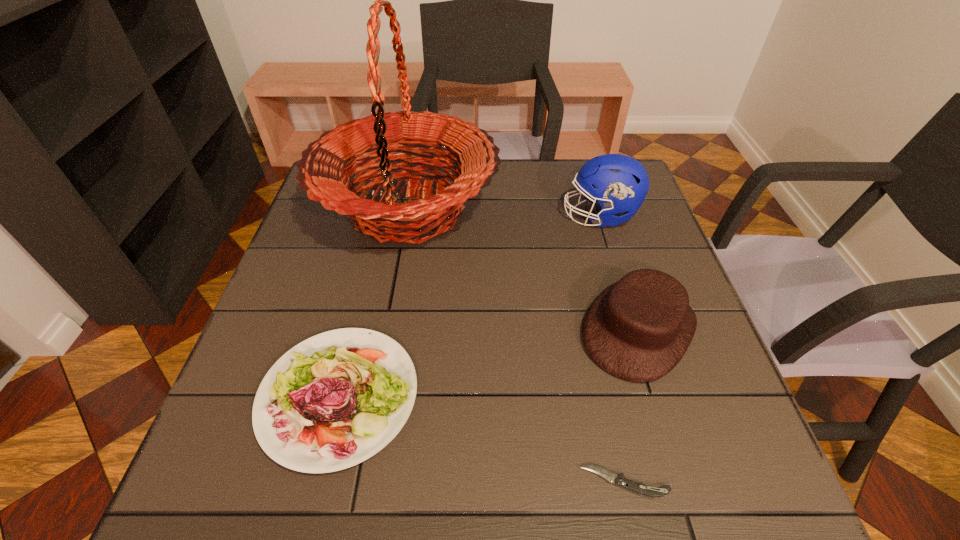
You are a GUI agent. You are given a task and a screenshot of the screen. Output one action in this format:
    pyautogui.click(x=<x>, y=<y>)
    Task: Click on the free space between the salad plate and the shortest object
    The image size is (960, 540).
    Given the screenshot: What is the action you would take?
    pyautogui.click(x=482, y=439)

This screenshot has height=540, width=960. Find the location of `unoccupied position between the third tallest object and the football helmet`. unoccupied position between the third tallest object and the football helmet is located at coordinates pos(619,272).

You are a GUI agent. You are given a task and a screenshot of the screen. Output one action in this format:
    pyautogui.click(x=<x>, y=<y>)
    Task: Click on the vacant space that's between the basket and the fourth tallest object
    
    Given the screenshot: What is the action you would take?
    pyautogui.click(x=373, y=303)

The height and width of the screenshot is (540, 960). What are the coordinates of `free spot between the football helmet and the third shortest object` in the screenshot? It's located at (619, 272).

I want to click on vacant area that lies between the second tallest object and the tallest object, so click(504, 212).

At what (x,y) coordinates should I click in order to perform the action: click on free space between the third tallest object and the football helmet. Please return your answer as a coordinate pair (x, y). Looking at the image, I should click on (619, 272).

Locate an element on the screen. The width and height of the screenshot is (960, 540). free spot between the second shortest object and the fourth shortest object is located at coordinates (469, 306).

Find the location of a particular element. This screenshot has height=540, width=960. blank region between the basket and the second tallest object is located at coordinates (504, 212).

You are a GUI agent. You are given a task and a screenshot of the screen. Output one action in this format:
    pyautogui.click(x=<x>, y=<y>)
    Task: Click on the third closest object to the third shortest object
    
    Given the screenshot: What is the action you would take?
    pyautogui.click(x=619, y=183)

Find the location of a particular element. object that can be found as the fourth closest to the shortest object is located at coordinates (619, 183).